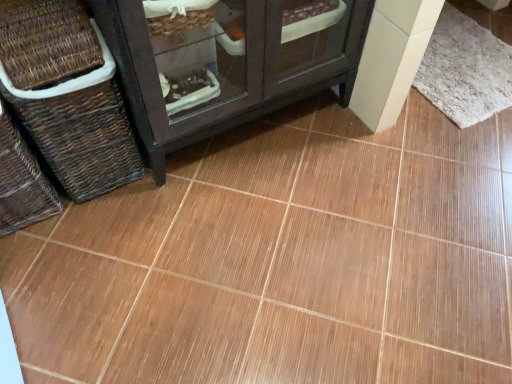
Question: In terms of size, does white fluffy mat at upper right appear bigger or smaller than brown woven basket at left, acting as the 2th basket starting from the left?

Choices:
 (A) small
 (B) big

Answer: (A)

Question: From a real-world perspective, is white fluffy mat at upper right positioned above or below brown woven basket at left, the first basket from the right?

Choices:
 (A) below
 (B) above

Answer: (A)

Question: Estimate the real-world distances between objects in this image. Which object is closer to the white fluffy mat at upper right?

Choices:
 (A) brown woven basket at left, the first basket in the left-to-right sequence
 (B) brown woven basket at left, acting as the 2th basket starting from the left

Answer: (B)

Question: Which is nearer to the brown woven basket at left, acting as the 2th basket starting from the left?

Choices:
 (A) white fluffy mat at upper right
 (B) brown woven basket at left, the second basket from the right

Answer: (B)